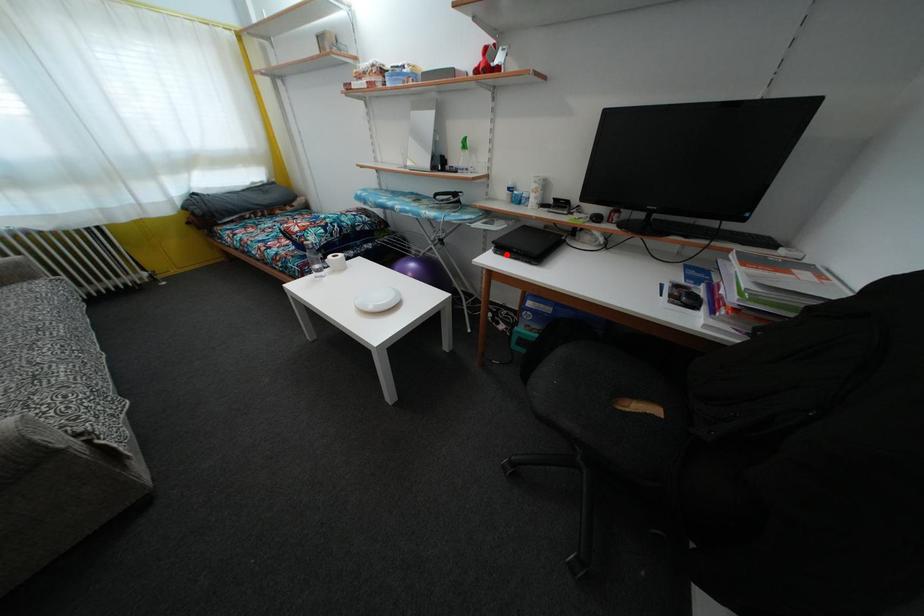
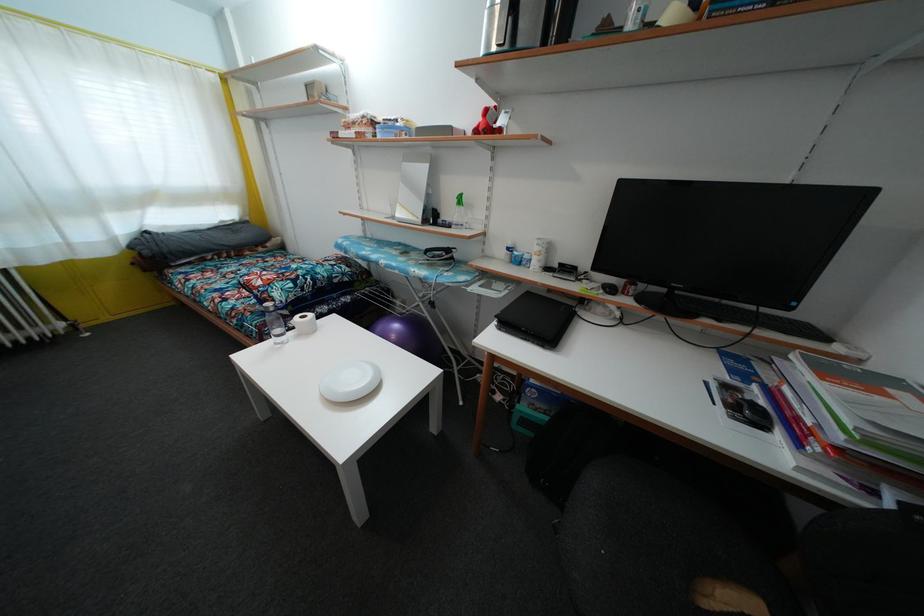
Find the pixel in the second image that matches the highlighted location in the first image.

(512, 331)